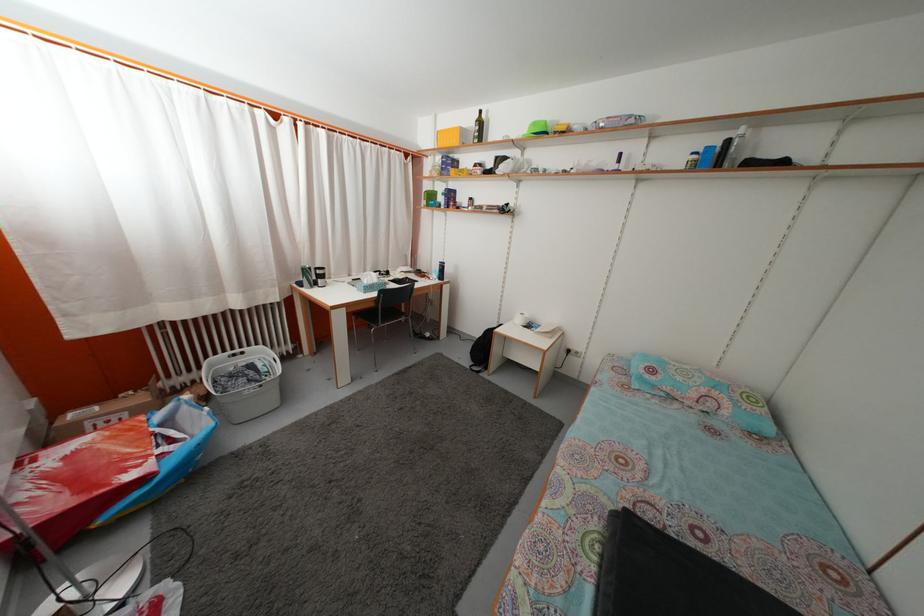
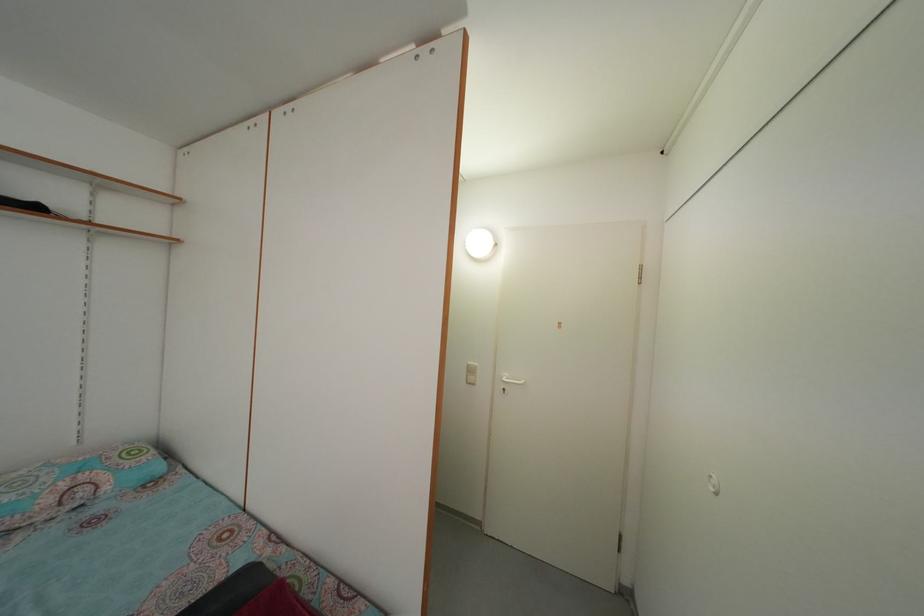
Question: Based on the continuous images, in which direction is the camera rotating? Reply with the corresponding letter.

Choices:
 (A) Left
 (B) Right
 (C) Up
 (D) Down

Answer: (B)